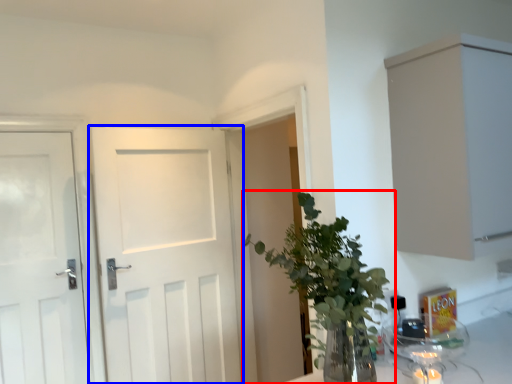
Question: Among these objects, which one is nearest to the camera, houseplant (highlighted by a red box) or door (highlighted by a blue box)?

Choices:
 (A) houseplant
 (B) door

Answer: (A)